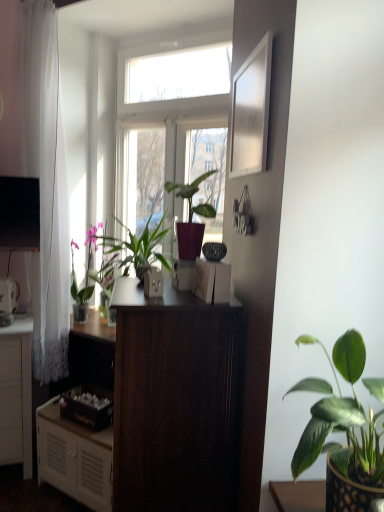
Question: Can you confirm if dark wood desk at center is wider than matte white outlet at center, which is the fourth appliance in bottom-to-top order?

Choices:
 (A) yes
 (B) no

Answer: (A)

Question: Is dark wood desk at center placed right next to matte white outlet at center, which appears as the second appliance when viewed from the front?

Choices:
 (A) yes
 (B) no

Answer: (B)

Question: From the image's perspective, is dark wood desk at center located beneath matte white outlet at center, the fourth appliance when ordered from back to front?

Choices:
 (A) no
 (B) yes

Answer: (B)

Question: From a real-world perspective, is dark wood desk at center beneath matte white outlet at center, the fourth appliance when ordered from back to front?

Choices:
 (A) no
 (B) yes

Answer: (B)

Question: Does dark wood desk at center have a lesser height compared to matte white outlet at center, the third appliance from the left?

Choices:
 (A) no
 (B) yes

Answer: (A)

Question: Is matte white outlet at center, the third appliance from the left, in front of or behind wooden crate at lower left, the 5th appliance viewed from the top, in the image?

Choices:
 (A) behind
 (B) front

Answer: (B)

Question: Is matte white outlet at center, the third appliance positioned from the right, wider or thinner than wooden crate at lower left, the fourth appliance positioned from the front?

Choices:
 (A) wide
 (B) thin

Answer: (B)

Question: From the image's perspective, is matte white outlet at center, which is the fourth appliance in bottom-to-top order, located above or below wooden crate at lower left, the fourth appliance positioned from the front?

Choices:
 (A) above
 (B) below

Answer: (A)

Question: Would you say matte white outlet at center, which is the fourth appliance in bottom-to-top order, is to the left or to the right of wooden crate at lower left, acting as the 1th appliance starting from the bottom, in the picture?

Choices:
 (A) right
 (B) left

Answer: (A)

Question: From a real-world perspective, relative to white glossy picture frame at upper right, is white matte cabinet at lower left vertically above or below?

Choices:
 (A) below
 (B) above

Answer: (A)

Question: Looking at the image, does white matte cabinet at lower left seem bigger or smaller compared to white glossy picture frame at upper right?

Choices:
 (A) big
 (B) small

Answer: (A)

Question: Is white matte cabinet at lower left wider or thinner than white glossy picture frame at upper right?

Choices:
 (A) thin
 (B) wide

Answer: (B)

Question: Is point (66, 439) closer or farther from the camera than point (264, 60)?

Choices:
 (A) farther
 (B) closer

Answer: (A)

Question: Is black glossy television at upper left situated inside white matte cabinet at lower left or outside?

Choices:
 (A) outside
 (B) inside

Answer: (A)

Question: Is black glossy television at upper left wider or thinner than white matte cabinet at lower left?

Choices:
 (A) thin
 (B) wide

Answer: (A)